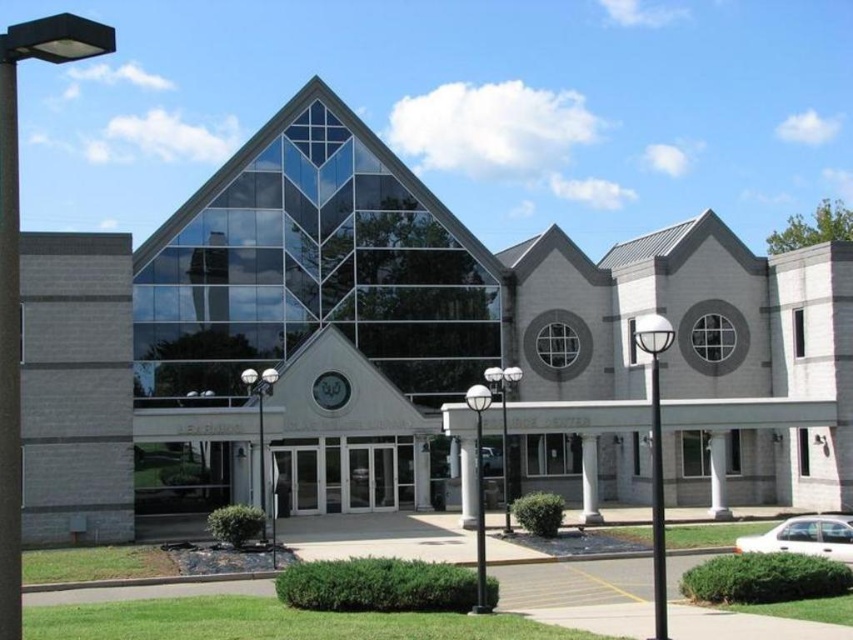
Question: Which object appears farthest from the camera in this image?

Choices:
 (A) white matte sedan at lower right
 (B) clear glass building at center

Answer: (B)

Question: Considering the real-world distances, which object is farthest from the clear glass building at center?

Choices:
 (A) white matte sedan at lower right
 (B) white stone pillar at center

Answer: (A)

Question: Can you confirm if white smooth column at center is positioned to the right of white concrete pillar at center?

Choices:
 (A) no
 (B) yes

Answer: (B)

Question: In this image, where is clear glass building at center located relative to white stone pillar at center?

Choices:
 (A) right
 (B) left

Answer: (A)

Question: Which of the following is the closest to the observer?

Choices:
 (A) white smooth column at center
 (B) white marble pillar at center
 (C) white matte sedan at lower right
 (D) white stone pillar at center

Answer: (C)

Question: Does white smooth column at center have a greater width compared to white concrete pillar at center?

Choices:
 (A) yes
 (B) no

Answer: (B)